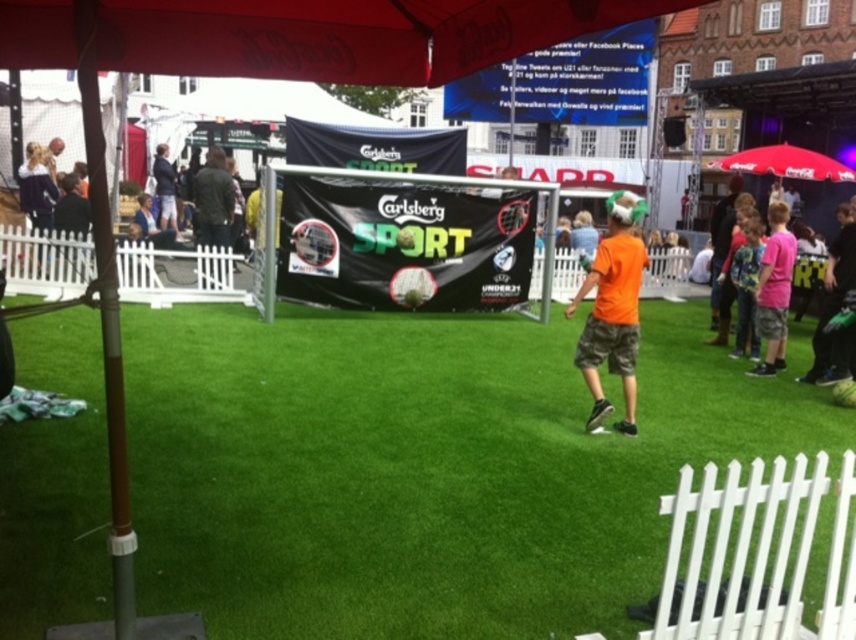
Is green artificial turf at center to the left of light blue denim shorts at center from the viewer's perspective?

No, green artificial turf at center is not to the left of light blue denim shorts at center.

Does green artificial turf at center have a greater height compared to light blue denim shorts at center?

No.

The image size is (856, 640). I want to click on green artificial turf at center, so click(x=421, y=468).

You are a GUI agent. You are given a task and a screenshot of the screen. Output one action in this format:
    pyautogui.click(x=<x>, y=<y>)
    Task: Click on the green artificial turf at center
    This screenshot has height=640, width=856.
    Given the screenshot: What is the action you would take?
    pyautogui.click(x=421, y=468)

Looking at this image, how much distance is there between orange matte shirt at center and light blue denim shorts at center?

9.95 meters

Which of these two, orange matte shirt at center or light blue denim shorts at center, stands taller?

With more height is light blue denim shorts at center.

What do you see at coordinates (611, 308) in the screenshot? I see `orange matte shirt at center` at bounding box center [611, 308].

Where is `orange matte shirt at center`? The height and width of the screenshot is (640, 856). orange matte shirt at center is located at coordinates [611, 308].

Who is taller, green artificial turf at center or orange matte shirt at center?

orange matte shirt at center is taller.

Does green artificial turf at center come behind orange matte shirt at center?

No, green artificial turf at center is closer to the viewer.

Between point (816, 602) and point (617, 333), which one is positioned in front?

Positioned in front is point (816, 602).

Identify the location of green artificial turf at center. (421, 468).